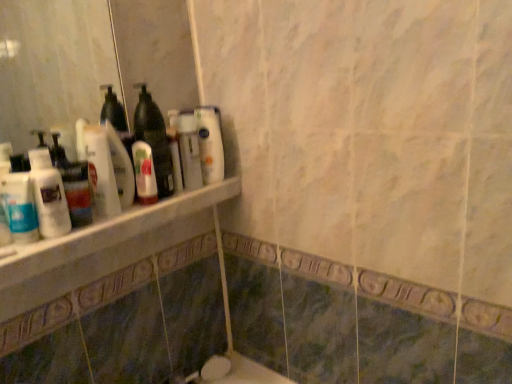
In order to click on blank space situated above white marble ledge at upper left (from a real-world perspective) in this screenshot , I will do `click(130, 210)`.